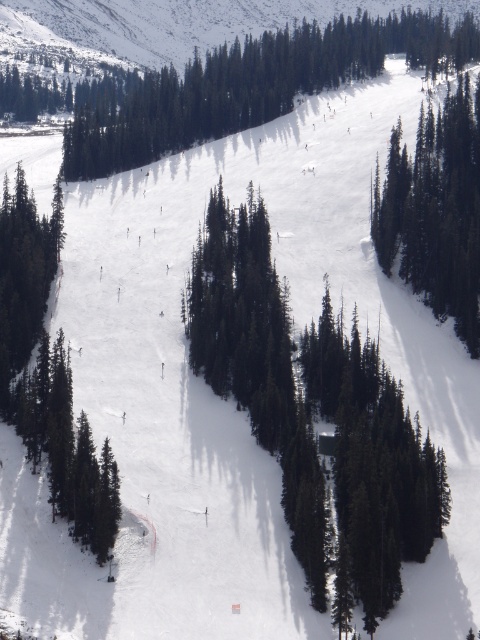
You are a photographer planning to capture the ski slope scene. You want to ensure both the green coniferous trees at center and the green matte tree at left are in the frame. Which tree has a wider spread when viewed from above?

The green coniferous trees at center has a wider spread than the green matte tree at left, as its width surpasses the latter.